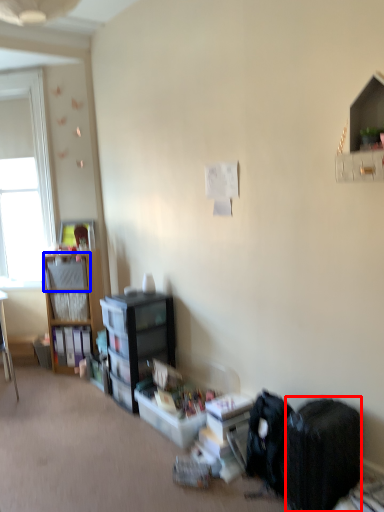
Question: Among these objects, which one is farthest to the camera, backpack (highlighted by a red box) or shelf (highlighted by a blue box)?

Choices:
 (A) backpack
 (B) shelf

Answer: (B)